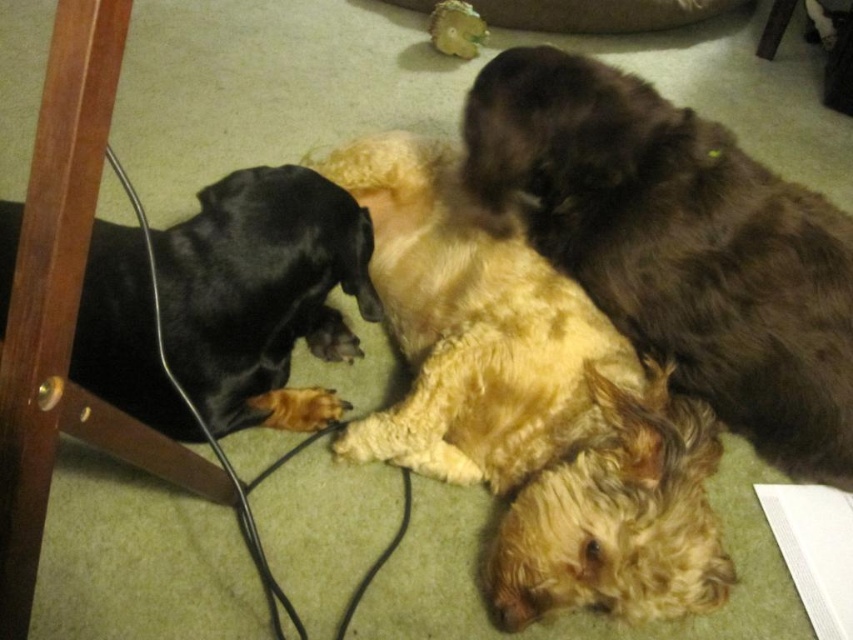
You are a photographer trying to capture a clear photo of both the fluffy golden dog at center and the black smooth fur dog at left. Which dog should you focus on first to ensure it is in sharp focus?

You should focus on the fluffy golden dog at center first because it is closer to you than the black smooth fur dog at left, so focusing on it first will ensure it stays sharp while the background dog may appear slightly blurred.

In the scene shown: You are a dog owner who wants to buy a new dog bed for both the fluffy golden dog at center and the fluffy brown dog at upper right. Based on their sizes, which dog would require a larger bed?

The fluffy golden dog at center requires a larger bed since its width is greater than that of the fluffy brown dog at upper right.

You are standing in the room and want to pick up an object. You notice two points on the floor marked as point [693,147] and point [126,404]. Which point is closer to you?

Point [693,147] is closer to you because it is further to the camera than point [126,404].